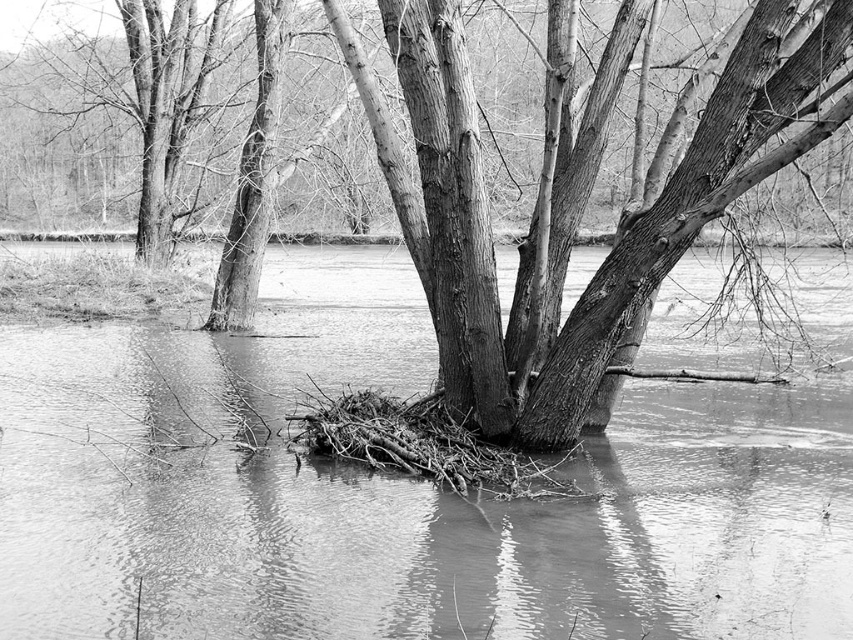
Question: Is smooth water at center wider than rough bark tree at center?

Choices:
 (A) yes
 (B) no

Answer: (A)

Question: Is smooth water at center wider than rough bark tree at center?

Choices:
 (A) no
 (B) yes

Answer: (B)

Question: Is smooth water at center further to camera compared to rough bark tree at center?

Choices:
 (A) yes
 (B) no

Answer: (B)

Question: Which point appears closest to the camera in this image?

Choices:
 (A) (598, 285)
 (B) (357, 592)

Answer: (B)

Question: Which point appears closest to the camera in this image?

Choices:
 (A) (450, 172)
 (B) (608, 557)

Answer: (B)